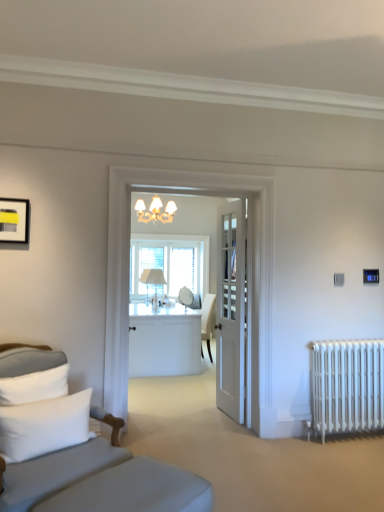
Question: Should I look upward or downward to see white glossy desk at center?

Choices:
 (A) down
 (B) up

Answer: (A)

Question: Is white soft pillow at lower left turned away from gray fabric studio couch at left?

Choices:
 (A) yes
 (B) no

Answer: (A)

Question: Considering the relative sizes of white soft pillow at lower left and gray fabric studio couch at left in the image provided, is white soft pillow at lower left smaller than gray fabric studio couch at left?

Choices:
 (A) no
 (B) yes

Answer: (B)

Question: Does white soft pillow at lower left come behind gray fabric studio couch at left?

Choices:
 (A) yes
 (B) no

Answer: (A)

Question: Does white soft pillow at lower left have a greater width compared to gray fabric studio couch at left?

Choices:
 (A) no
 (B) yes

Answer: (A)

Question: Does white soft pillow at lower left come in front of gray fabric studio couch at left?

Choices:
 (A) no
 (B) yes

Answer: (A)

Question: From the image's perspective, is white soft pillow at lower left on top of gray fabric studio couch at left?

Choices:
 (A) yes
 (B) no

Answer: (A)

Question: Is clear glass window at center positioned beyond the bounds of matte black picture frame at upper left?

Choices:
 (A) yes
 (B) no

Answer: (A)

Question: Considering the relative sizes of clear glass window at center and matte black picture frame at upper left in the image provided, is clear glass window at center taller than matte black picture frame at upper left?

Choices:
 (A) no
 (B) yes

Answer: (B)

Question: Considering the relative sizes of clear glass window at center and matte black picture frame at upper left in the image provided, is clear glass window at center smaller than matte black picture frame at upper left?

Choices:
 (A) no
 (B) yes

Answer: (A)

Question: Is clear glass window at center thinner than matte black picture frame at upper left?

Choices:
 (A) no
 (B) yes

Answer: (A)

Question: From a real-world perspective, is clear glass window at center on top of matte black picture frame at upper left?

Choices:
 (A) no
 (B) yes

Answer: (A)

Question: Could you tell me if clear glass window at center is turned towards matte black picture frame at upper left?

Choices:
 (A) no
 (B) yes

Answer: (B)

Question: From the image's perspective, is white metal radiator at lower right below gray fabric studio couch at left?

Choices:
 (A) no
 (B) yes

Answer: (B)